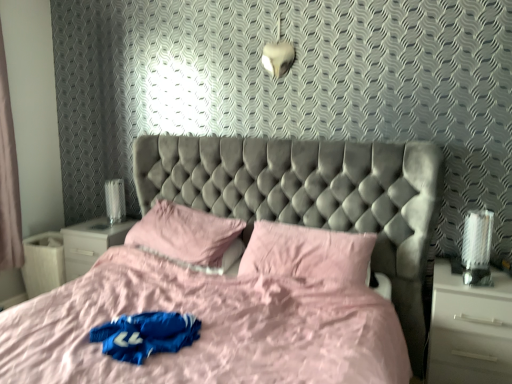
Question: Should I look upward or downward to see pink fabric pillow at center, marked as the second pillow in a right-to-left arrangement?

Choices:
 (A) down
 (B) up

Answer: (A)

Question: Is white glossy table lamp at left taller than pink fabric pillow at center, marked as the second pillow in a right-to-left arrangement?

Choices:
 (A) no
 (B) yes

Answer: (A)

Question: Considering the relative sizes of white glossy table lamp at left and pink fabric pillow at center, positioned as the 1th pillow in left-to-right order, in the image provided, is white glossy table lamp at left thinner than pink fabric pillow at center, positioned as the 1th pillow in left-to-right order,?

Choices:
 (A) yes
 (B) no

Answer: (A)

Question: Does white glossy table lamp at left lie behind pink fabric pillow at center, marked as the second pillow in a right-to-left arrangement?

Choices:
 (A) no
 (B) yes

Answer: (B)

Question: Is the depth of white glossy table lamp at left less than that of pink fabric pillow at center, marked as the second pillow in a right-to-left arrangement?

Choices:
 (A) no
 (B) yes

Answer: (A)

Question: Is white glossy table lamp at left completely or partially outside of pink fabric pillow at center, positioned as the 1th pillow in left-to-right order?

Choices:
 (A) yes
 (B) no

Answer: (A)

Question: Can you confirm if white glossy table lamp at left is shorter than pink fabric pillow at center, marked as the second pillow in a right-to-left arrangement?

Choices:
 (A) no
 (B) yes

Answer: (B)

Question: Considering the relative sizes of pink fabric curtain at left and white glossy table lamp at left in the image provided, is pink fabric curtain at left taller than white glossy table lamp at left?

Choices:
 (A) no
 (B) yes

Answer: (B)

Question: Is pink fabric curtain at left positioned in front of white glossy table lamp at left?

Choices:
 (A) yes
 (B) no

Answer: (A)

Question: Is pink fabric curtain at left to the left of white glossy table lamp at left from the viewer's perspective?

Choices:
 (A) yes
 (B) no

Answer: (A)

Question: From a real-world perspective, is pink fabric curtain at left located higher than white glossy table lamp at left?

Choices:
 (A) yes
 (B) no

Answer: (A)

Question: Is pink fabric curtain at left bigger than white glossy table lamp at left?

Choices:
 (A) no
 (B) yes

Answer: (B)

Question: Is pink fabric curtain at left next to white glossy table lamp at left and touching it?

Choices:
 (A) no
 (B) yes

Answer: (A)

Question: Can you confirm if white glossy nightstand at lower left, which is the 2th nightstand in right-to-left order, is wider than pink fabric curtain at left?

Choices:
 (A) yes
 (B) no

Answer: (A)